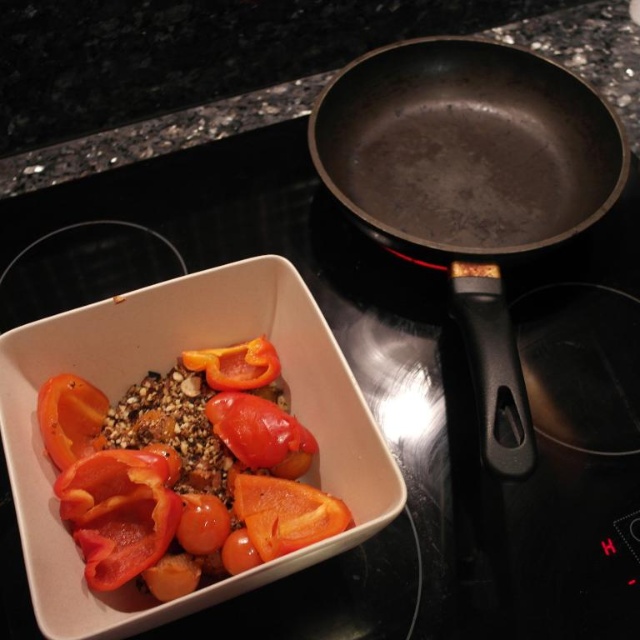
Looking at this image, between glossy red tomato at center and sliced matte orange tomato at lower left, which one has less height?

glossy red tomato at center

Can you confirm if glossy red tomato at center is bigger than sliced matte orange tomato at lower left?

Indeed, glossy red tomato at center has a larger size compared to sliced matte orange tomato at lower left.

Is point (269, 412) closer to viewer compared to point (44, 426)?

No, it is not.

The image size is (640, 640). What are the coordinates of `glossy red tomato at center` in the screenshot? It's located at (260, 433).

Looking at this image, is matte black wok at right shorter than slightly translucent orange bell pepper at center?

No.

Which is below, matte black wok at right or slightly translucent orange bell pepper at center?

Positioned lower is slightly translucent orange bell pepper at center.

Describe the element at coordinates (470, 182) in the screenshot. I see `matte black wok at right` at that location.

Locate an element on the screen. matte black wok at right is located at coordinates (470, 182).

Which is more to the right, glossy red tomato at center or glossy orange tomato at center?

glossy red tomato at center

Is glossy red tomato at center in front of glossy orange tomato at center?

No, glossy red tomato at center is further to the viewer.

Describe the element at coordinates (260, 433) in the screenshot. I see `glossy red tomato at center` at that location.

The height and width of the screenshot is (640, 640). Identify the location of glossy red tomato at center. (260, 433).